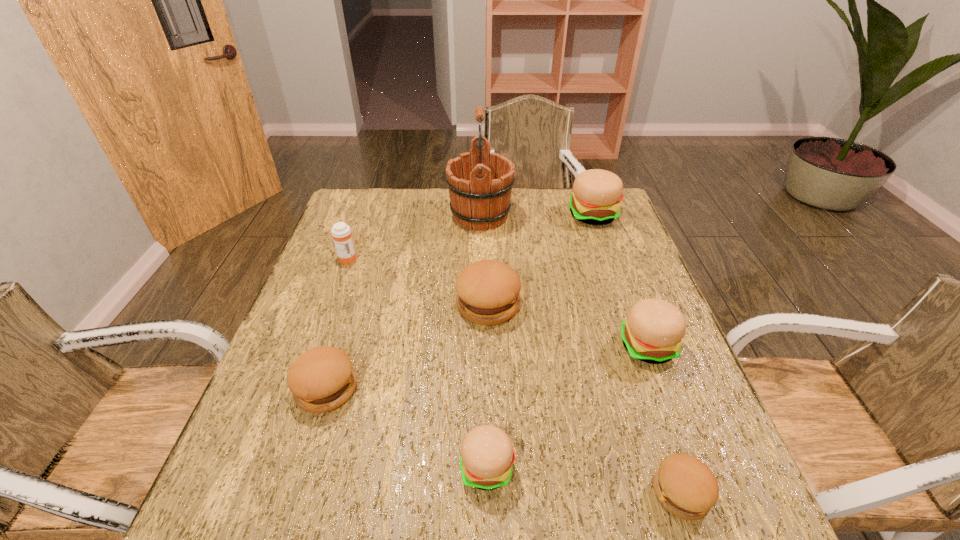
This screenshot has height=540, width=960. Identify the location of vacant space at the far edge of the desktop. (402, 208).

This screenshot has height=540, width=960. In order to click on vacant area at the near edge in this screenshot , I will do `click(479, 529)`.

In the image, there is a desktop. Where is `free space at the left edge`? free space at the left edge is located at coordinates (317, 285).

You are a GUI agent. You are given a task and a screenshot of the screen. Output one action in this format:
    pyautogui.click(x=<x>, y=<y>)
    Task: Click on the vacant region at the right edge
    The width and height of the screenshot is (960, 540).
    Given the screenshot: What is the action you would take?
    click(x=610, y=301)

In the image, there is a desktop. In order to click on free region at the near left corner in this screenshot , I will do coord(228,501).

Locate an element on the screen. vacant space that's between the wine bucket and the second brown hamburger from right to left is located at coordinates (484, 260).

At what (x,y) coordinates should I click in order to perform the action: click on free space that is in between the farthest hamburger and the second nearest beige hamburger. Please return your answer as a coordinate pair (x, y). The height and width of the screenshot is (540, 960). Looking at the image, I should click on (620, 280).

At what (x,y) coordinates should I click in order to perform the action: click on free space that is in between the second smallest beige hamburger and the second brown hamburger from right to left. Please return your answer as a coordinate pair (x, y). This screenshot has height=540, width=960. Looking at the image, I should click on (568, 325).

At what (x,y) coordinates should I click in order to perform the action: click on vacant space in between the wood wine bucket and the medicine. Please return your answer as a coordinate pair (x, y). This screenshot has height=540, width=960. Looking at the image, I should click on (414, 237).

The image size is (960, 540). Find the location of `vacant space that is in between the leftmost beige hamburger and the second farthest beige hamburger`. vacant space that is in between the leftmost beige hamburger and the second farthest beige hamburger is located at coordinates (567, 407).